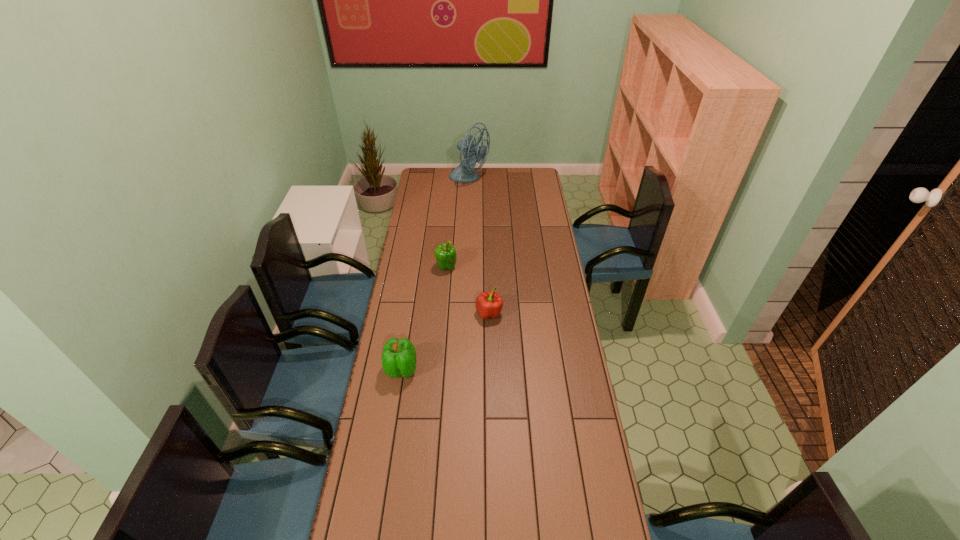
At what (x,y) coordinates should I click in order to perform the action: click on vacant area situated on the back of the leftmost bell pepper. Please return your answer as a coordinate pair (x, y). This screenshot has width=960, height=540. Looking at the image, I should click on (406, 338).

Locate an element on the screen. The height and width of the screenshot is (540, 960). free region located 0.190m on the front of the shortest object is located at coordinates (490, 361).

This screenshot has width=960, height=540. Find the location of `object that is at the far edge`. object that is at the far edge is located at coordinates (464, 172).

The width and height of the screenshot is (960, 540). I want to click on object located in the left edge section of the desktop, so click(399, 359).

In the image, there is a desktop. In order to click on vacant space at the far edge in this screenshot , I will do `click(483, 184)`.

Locate an element on the screen. This screenshot has height=540, width=960. vacant area at the right edge is located at coordinates (546, 323).

In the image, there is a desktop. Identify the location of vacant space at the far right corner. The width and height of the screenshot is (960, 540). (523, 173).

Where is `vacant point located between the tallest object and the second nearest object`? The width and height of the screenshot is (960, 540). vacant point located between the tallest object and the second nearest object is located at coordinates (479, 246).

At what (x,y) coordinates should I click in order to perform the action: click on unoccupied position between the nearest object and the farthest bell pepper. Please return your answer as a coordinate pair (x, y). Image resolution: width=960 pixels, height=540 pixels. Looking at the image, I should click on (424, 318).

This screenshot has width=960, height=540. Find the location of `vacant point located between the third nearest object and the nearest bell pepper`. vacant point located between the third nearest object and the nearest bell pepper is located at coordinates (424, 318).